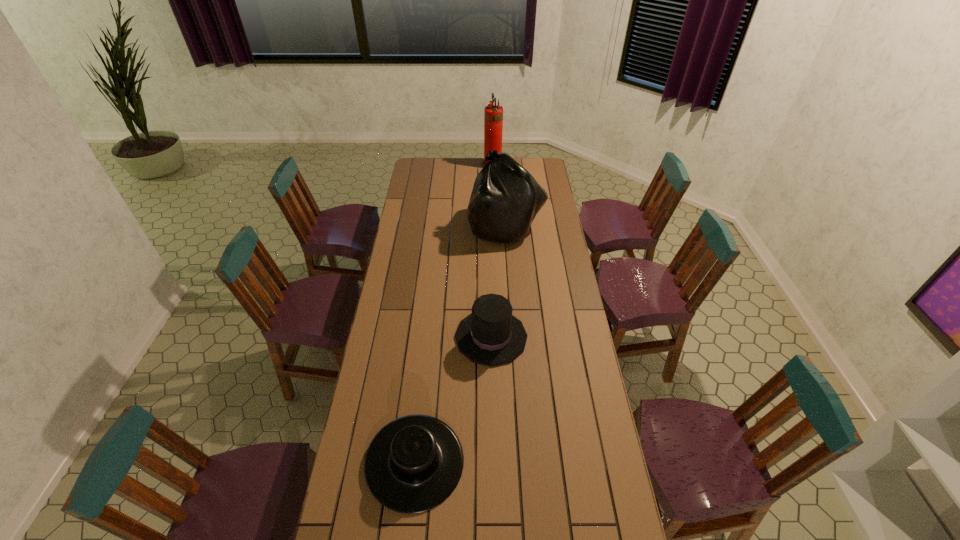
This screenshot has width=960, height=540. What are the coordinates of `free point located 0.290m on the front of the farther dress hat with the decoration` in the screenshot? It's located at (383, 337).

Locate an element on the screen. This screenshot has height=540, width=960. vacant space located 0.110m on the front of the farther dress hat with the decoration is located at coordinates (428, 337).

In order to click on vacant space located on the front of the farther dress hat with the decoration in this screenshot , I will do `click(389, 337)`.

In order to click on vacant area situated 0.290m on the right of the shorter dress hat in this screenshot , I will do `click(553, 462)`.

Locate an element on the screen. object located at the far edge is located at coordinates 493,114.

Find the location of a particular element. object positioned at the left edge is located at coordinates (413, 464).

Where is `object that is positioned at the right edge`? object that is positioned at the right edge is located at coordinates (505, 199).

You are a GUI agent. You are given a task and a screenshot of the screen. Output one action in this format:
    pyautogui.click(x=<x>, y=<y>)
    Task: Click on the vacant space at the left edge
    Image resolution: width=960 pixels, height=540 pixels.
    Given the screenshot: What is the action you would take?
    pyautogui.click(x=412, y=291)

In order to click on vacant space at the right edge in this screenshot , I will do `click(562, 470)`.

Find the location of a particular element. empty space between the third tallest object and the second farthest object is located at coordinates (498, 281).